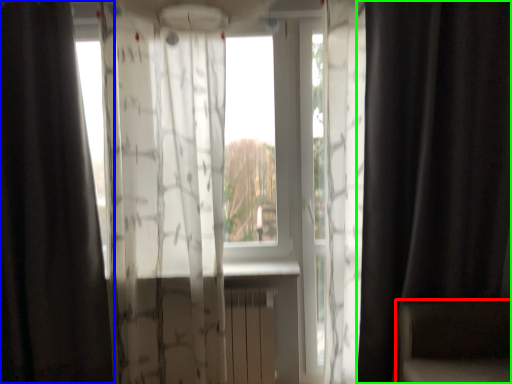
Question: Considering the real-world distances, which object is farthest from armchair (highlighted by a red box)? curtain (highlighted by a blue box) or curtain (highlighted by a green box)?

Choices:
 (A) curtain
 (B) curtain

Answer: (A)